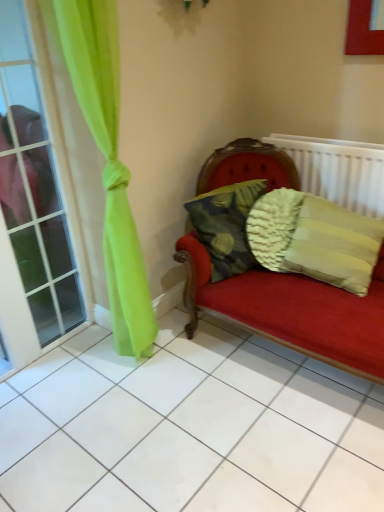
Question: Is textured beige pillow at right, arranged as the second pillow when viewed from the left, surrounded by clear glass window at left?

Choices:
 (A) no
 (B) yes

Answer: (A)

Question: From a real-world perspective, is clear glass window at left located beneath textured beige pillow at right, arranged as the first pillow when viewed from the right?

Choices:
 (A) yes
 (B) no

Answer: (B)

Question: Is clear glass window at left turned away from textured beige pillow at right, arranged as the first pillow when viewed from the right?

Choices:
 (A) no
 (B) yes

Answer: (A)

Question: Is clear glass window at left behind textured beige pillow at right, arranged as the second pillow when viewed from the left?

Choices:
 (A) yes
 (B) no

Answer: (B)

Question: Considering the relative positions of clear glass window at left and textured beige pillow at right, arranged as the first pillow when viewed from the right, in the image provided, is clear glass window at left to the left of textured beige pillow at right, arranged as the first pillow when viewed from the right, from the viewer's perspective?

Choices:
 (A) no
 (B) yes

Answer: (B)

Question: Looking at the image, does camouflage fabric pillow at center, the 1th pillow positioned from the left, seem bigger or smaller compared to textured beige pillow at right, arranged as the second pillow when viewed from the left?

Choices:
 (A) big
 (B) small

Answer: (B)

Question: Considering the positions of camouflage fabric pillow at center, the 1th pillow positioned from the left, and textured beige pillow at right, arranged as the second pillow when viewed from the left, in the image, is camouflage fabric pillow at center, the 1th pillow positioned from the left, taller or shorter than textured beige pillow at right, arranged as the second pillow when viewed from the left,?

Choices:
 (A) tall
 (B) short

Answer: (B)

Question: From the image's perspective, relative to textured beige pillow at right, arranged as the first pillow when viewed from the right, is camouflage fabric pillow at center, positioned as the 2th pillow in right-to-left order, above or below?

Choices:
 (A) below
 (B) above

Answer: (B)

Question: Considering the positions of point (233, 269) and point (289, 234), is point (233, 269) closer or farther from the camera than point (289, 234)?

Choices:
 (A) closer
 (B) farther

Answer: (B)

Question: In the image, is clear glass window at left positioned in front of or behind camouflage fabric pillow at center, positioned as the 2th pillow in right-to-left order?

Choices:
 (A) behind
 (B) front

Answer: (B)

Question: From a real-world perspective, is clear glass window at left positioned above or below camouflage fabric pillow at center, the 1th pillow positioned from the left?

Choices:
 (A) below
 (B) above

Answer: (B)

Question: Do you think clear glass window at left is within camouflage fabric pillow at center, positioned as the 2th pillow in right-to-left order, or outside of it?

Choices:
 (A) outside
 (B) inside

Answer: (A)

Question: Does point (11, 45) appear closer or farther from the camera than point (231, 229)?

Choices:
 (A) farther
 (B) closer

Answer: (A)

Question: In terms of size, does white textured radiator at upper right appear bigger or smaller than clear glass window at left?

Choices:
 (A) small
 (B) big

Answer: (A)

Question: Which is correct: white textured radiator at upper right is inside clear glass window at left, or outside of it?

Choices:
 (A) inside
 (B) outside

Answer: (B)